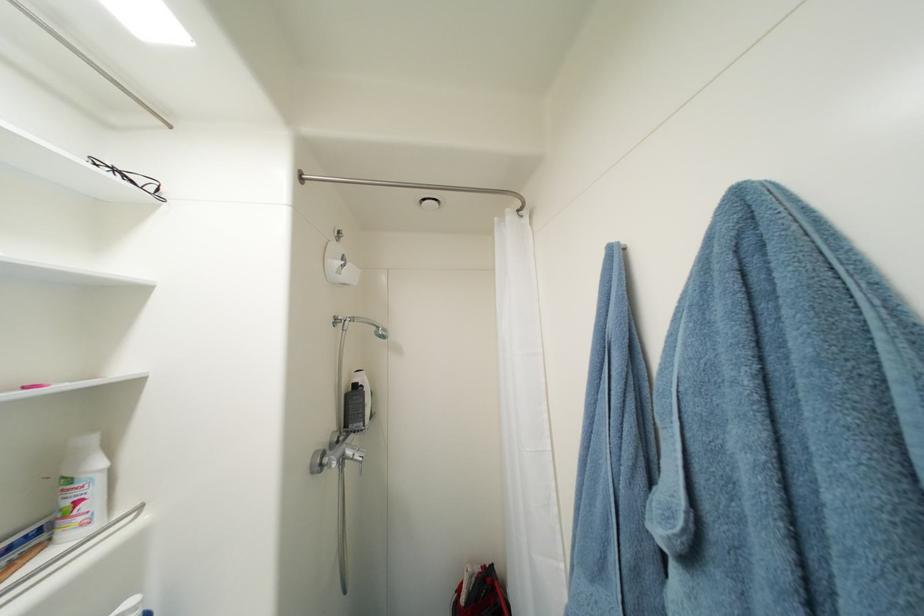
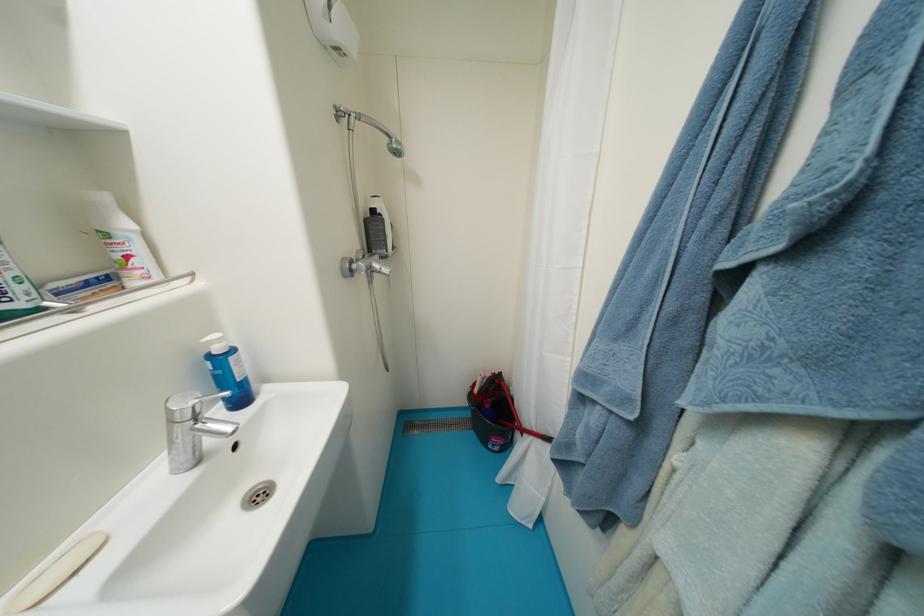
Where in the second image is the point corresponding to the point at 356,454 from the first image?

(383, 267)